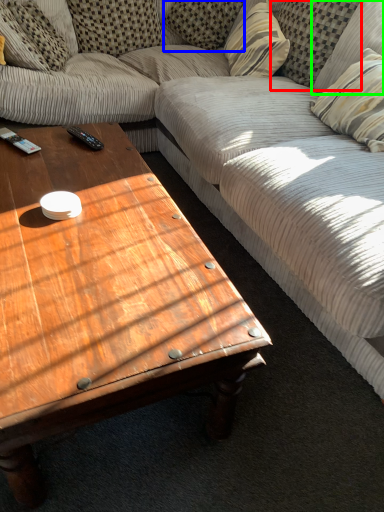
Question: Considering the real-world distances, which object is farthest from pillow (highlighted by a red box)? pillow (highlighted by a blue box) or pillow (highlighted by a green box)?

Choices:
 (A) pillow
 (B) pillow

Answer: (A)